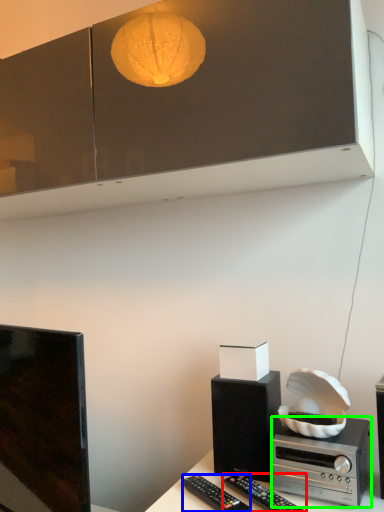
Question: Considering the real-world distances, which object is closest to remote control (highlighted by a red box)? remote control (highlighted by a blue box) or stereo (highlighted by a green box).

Choices:
 (A) remote control
 (B) stereo

Answer: (A)